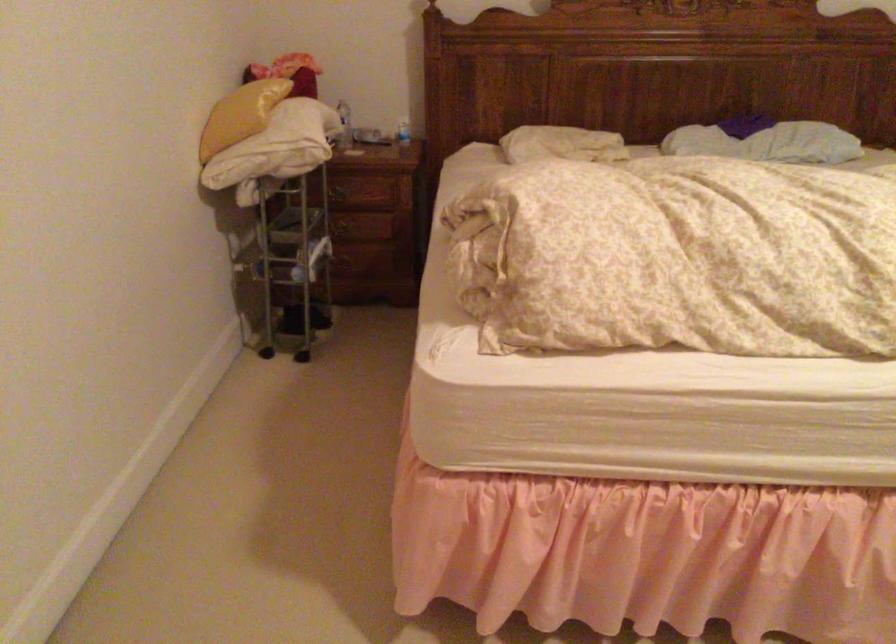
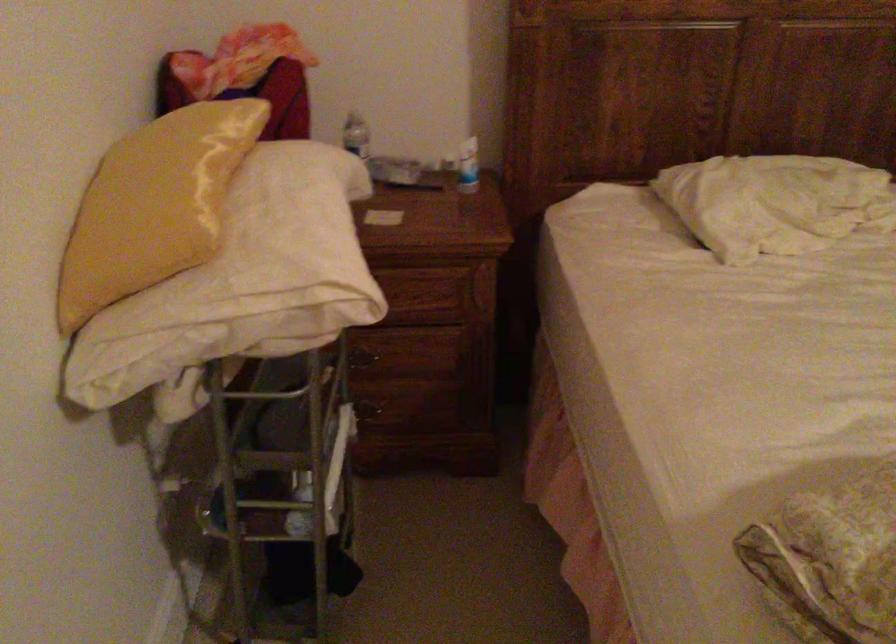
Locate, in the second image, the point that corresponds to (375,232) in the first image.

(412, 365)